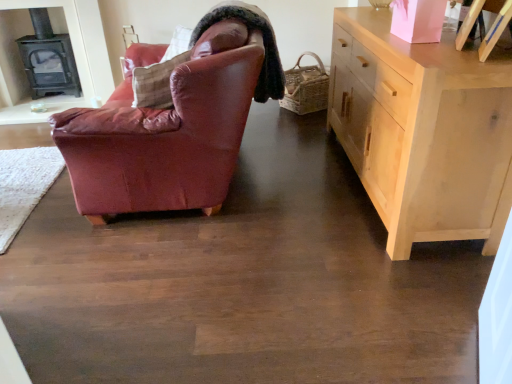
Question: Is leather-like brown pillow at upper center at the back of light wood cabinet at right?

Choices:
 (A) no
 (B) yes

Answer: (A)

Question: Is light wood cabinet at right positioned in front of leather-like brown pillow at upper center?

Choices:
 (A) no
 (B) yes

Answer: (B)

Question: Is light wood cabinet at right positioned beyond the bounds of leather-like brown pillow at upper center?

Choices:
 (A) no
 (B) yes

Answer: (B)

Question: Does light wood cabinet at right have a larger size compared to leather-like brown pillow at upper center?

Choices:
 (A) yes
 (B) no

Answer: (A)

Question: Is light wood cabinet at right smaller than leather-like brown pillow at upper center?

Choices:
 (A) yes
 (B) no

Answer: (B)

Question: Is leather-like brown pillow at upper center taller or shorter than light wood cabinet at right?

Choices:
 (A) tall
 (B) short

Answer: (B)

Question: Is leather-like brown pillow at upper center inside or outside of light wood cabinet at right?

Choices:
 (A) inside
 (B) outside

Answer: (B)

Question: From a real-world perspective, is leather-like brown pillow at upper center above or below light wood cabinet at right?

Choices:
 (A) above
 (B) below

Answer: (A)

Question: From the image's perspective, is leather-like brown pillow at upper center above or below light wood cabinet at right?

Choices:
 (A) below
 (B) above

Answer: (B)

Question: Which is correct: light wood cabinet at right is inside black cast iron fireplace at upper left, or outside of it?

Choices:
 (A) outside
 (B) inside

Answer: (A)

Question: From a real-world perspective, is light wood cabinet at right physically located above or below black cast iron fireplace at upper left?

Choices:
 (A) above
 (B) below

Answer: (B)

Question: From the image's perspective, is light wood cabinet at right located above or below black cast iron fireplace at upper left?

Choices:
 (A) below
 (B) above

Answer: (A)

Question: Is point (423, 62) closer or farther from the camera than point (48, 48)?

Choices:
 (A) farther
 (B) closer

Answer: (B)

Question: From a real-world perspective, relative to leather-like brown pillow at upper center, is light wood cabinet at right vertically above or below?

Choices:
 (A) below
 (B) above

Answer: (A)

Question: Looking at their shapes, would you say light wood cabinet at right is wider or thinner than leather-like brown pillow at upper center?

Choices:
 (A) thin
 (B) wide

Answer: (B)